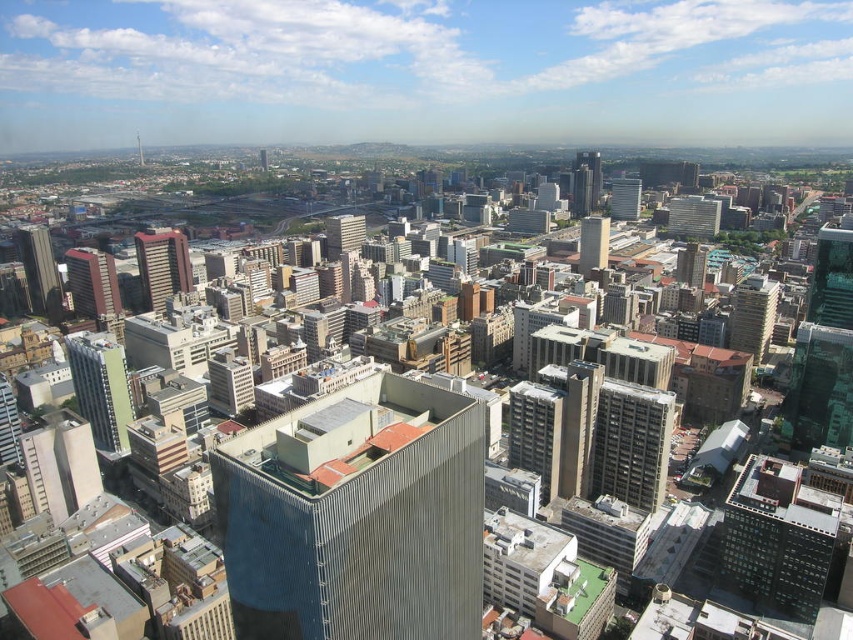
You are a city planner analyzing the layout of this area. You need to place a new emergency access point between the green glass tower at lower left and the matte gray building at center. Based on their positions, which building should the access point be closer to?

The emergency access point should be closer to the green glass tower at lower left since it is positioned to the left of the matte gray building at center.

You are a drone operator who needs to deliver a package to the green glass tower at lower left. The drone has a maximum flight range of 800 feet. Based on the scene, can the drone reach the tower?

The green glass tower at lower left is 823.07 feet from the camera, which exceeds the drone operator drone maximum flight range of 800 feet. Therefore, the drone cannot reach the tower.